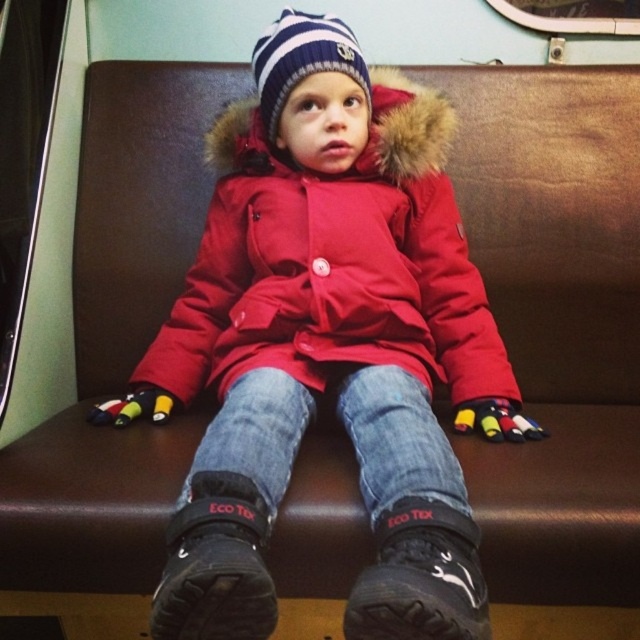
Can you confirm if matte red coat at center is bigger than jeans at center?

Correct, matte red coat at center is larger in size than jeans at center.

Which of these two, matte red coat at center or jeans at center, stands shorter?

jeans at center

Who is more distant from viewer, (330,230) or (276,404)?

Positioned behind is point (330,230).

This screenshot has height=640, width=640. I want to click on matte red coat at center, so 326,346.

Between matte red coat at center and red matte jacket at center, which one has more height?

Standing taller between the two is matte red coat at center.

How much distance is there between matte red coat at center and red matte jacket at center?

1.59 inches

Measure the distance between point [406,390] and camera.

Point [406,390] and camera are 35.39 inches apart.

Locate an element on the screen. This screenshot has width=640, height=640. matte red coat at center is located at coordinates (326, 346).

Does red matte jacket at center have a lesser width compared to striped knit hat at center?

No.

Between red matte jacket at center and striped knit hat at center, which one is positioned higher?

Positioned higher is striped knit hat at center.

Identify the location of red matte jacket at center. This screenshot has height=640, width=640. (333, 262).